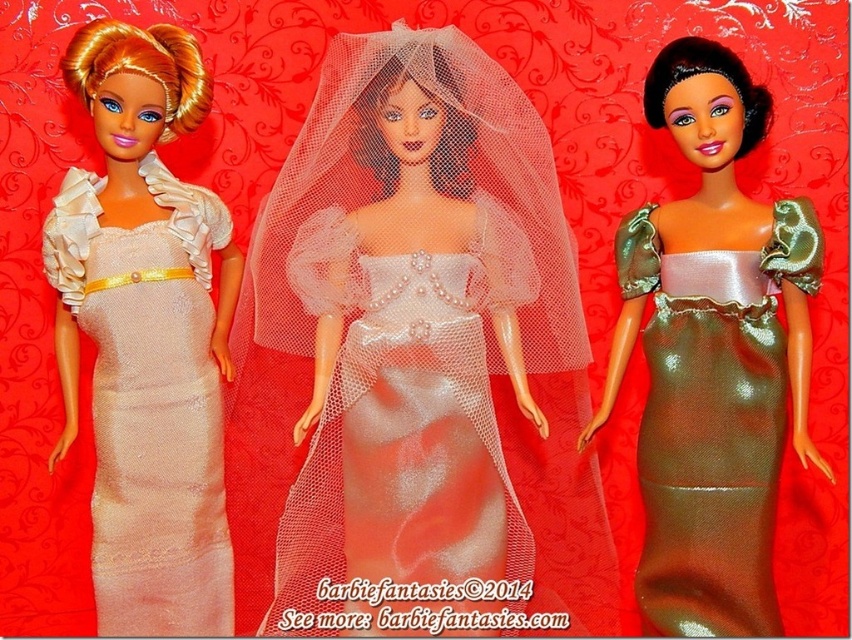
Question: Which of the following is the closest to the observer?

Choices:
 (A) pearl white satin dress at center
 (B) shiny gold dress at center

Answer: (B)

Question: Which object is the farthest from the matte cream dress at center?

Choices:
 (A) pearl white satin dress at center
 (B) shiny gold dress at center

Answer: (B)

Question: Which point is farther to the camera?

Choices:
 (A) pearl white satin dress at center
 (B) matte cream dress at center

Answer: (B)

Question: Is pearl white satin dress at center behind matte cream dress at center?

Choices:
 (A) yes
 (B) no

Answer: (B)

Question: Is pearl white satin dress at center wider than shiny gold dress at center?

Choices:
 (A) yes
 (B) no

Answer: (A)

Question: Is pearl white satin dress at center above shiny gold dress at center?

Choices:
 (A) yes
 (B) no

Answer: (B)